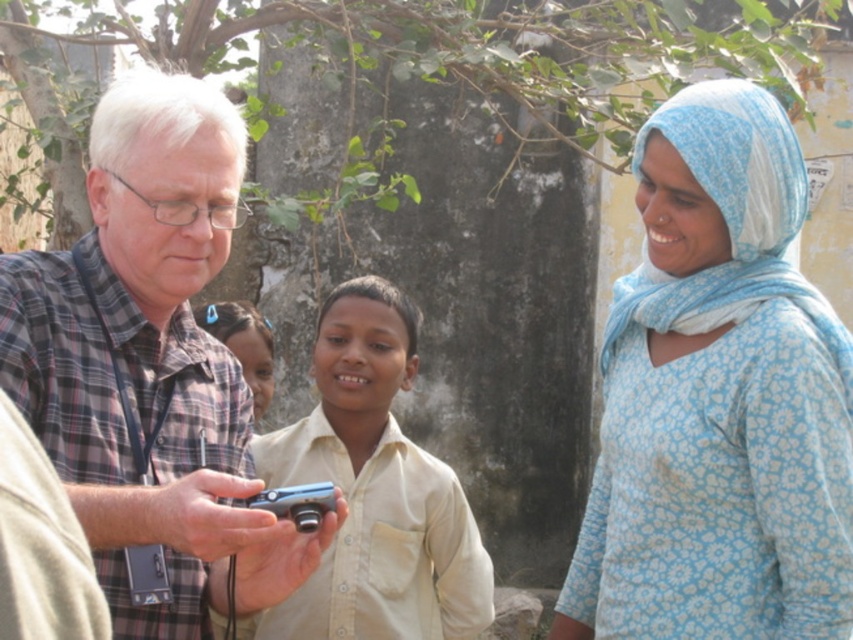
Question: Can you confirm if light blue floral fabric headscarf at right is smaller than plaid shirt at left?

Choices:
 (A) yes
 (B) no

Answer: (A)

Question: Where is light brown hair at center located in relation to metallic silver camera at center in the image?

Choices:
 (A) below
 (B) above

Answer: (B)

Question: Which object is farther from the camera taking this photo?

Choices:
 (A) light brown hair at center
 (B) light blue floral fabric headscarf at right

Answer: (A)

Question: Which object is farther from the camera taking this photo?

Choices:
 (A) plaid shirt at left
 (B) light blue floral fabric headscarf at right
 (C) beige cotton shirt at center
 (D) light brown hair at center

Answer: (D)

Question: Considering the real-world distances, which object is closest to the plaid shirt at left?

Choices:
 (A) metallic silver camera at center
 (B) light blue floral fabric headscarf at right
 (C) beige cotton shirt at center

Answer: (A)

Question: In this image, where is beige cotton shirt at center located relative to metallic silver camera at center?

Choices:
 (A) below
 (B) above

Answer: (B)